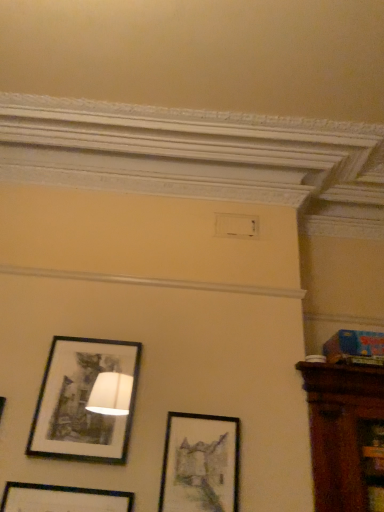
Question: From their relative heights in the image, would you say matte black picture frame at center, which ranks as the 1th picture frame in right-to-left order, is taller or shorter than black matte picture frame at upper left, placed as the 2th picture frame when sorted from right to left?

Choices:
 (A) tall
 (B) short

Answer: (B)

Question: Do you think matte black picture frame at center, which is the 2th picture frame in left-to-right order, is within black matte picture frame at upper left, acting as the 1th picture frame starting from the left, or outside of it?

Choices:
 (A) outside
 (B) inside

Answer: (A)

Question: From the image's perspective, relative to black matte picture frame at upper left, placed as the 2th picture frame when sorted from right to left, is matte black picture frame at center, which is the 2th picture frame in left-to-right order, above or below?

Choices:
 (A) below
 (B) above

Answer: (A)

Question: In terms of width, does black matte picture frame at upper left, placed as the 2th picture frame when sorted from right to left, look wider or thinner when compared to matte black picture frame at center, which is the 2th picture frame in left-to-right order?

Choices:
 (A) wide
 (B) thin

Answer: (A)

Question: From a real-world perspective, relative to matte black picture frame at center, which is the 2th picture frame in left-to-right order, is black matte picture frame at upper left, placed as the 2th picture frame when sorted from right to left, vertically above or below?

Choices:
 (A) below
 (B) above

Answer: (B)

Question: Is point (x=46, y=385) closer or farther from the camera than point (x=238, y=440)?

Choices:
 (A) farther
 (B) closer

Answer: (A)

Question: Is black matte picture frame at upper left, acting as the 1th picture frame starting from the left, spatially inside matte black picture frame at center, which ranks as the 1th picture frame in right-to-left order, or outside of it?

Choices:
 (A) inside
 (B) outside

Answer: (B)